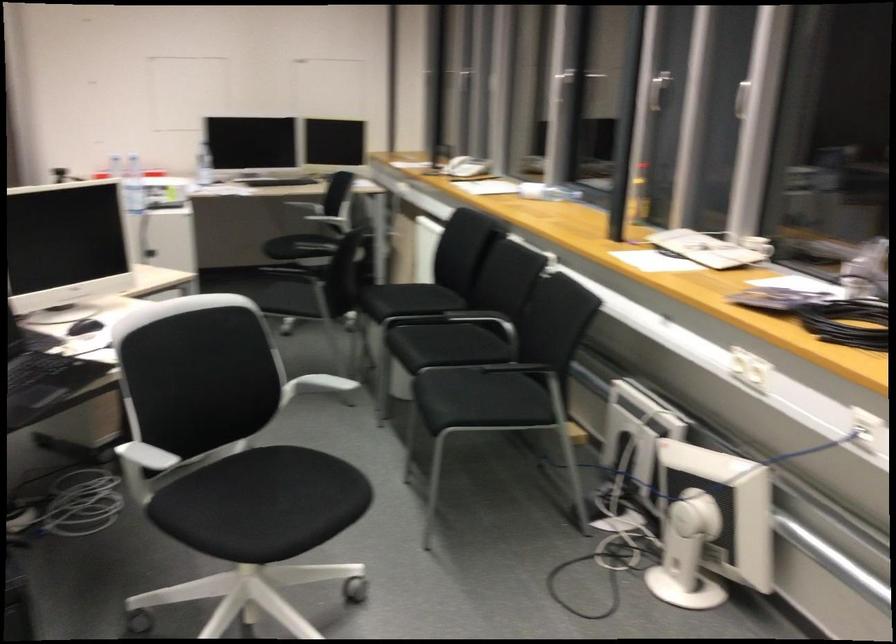
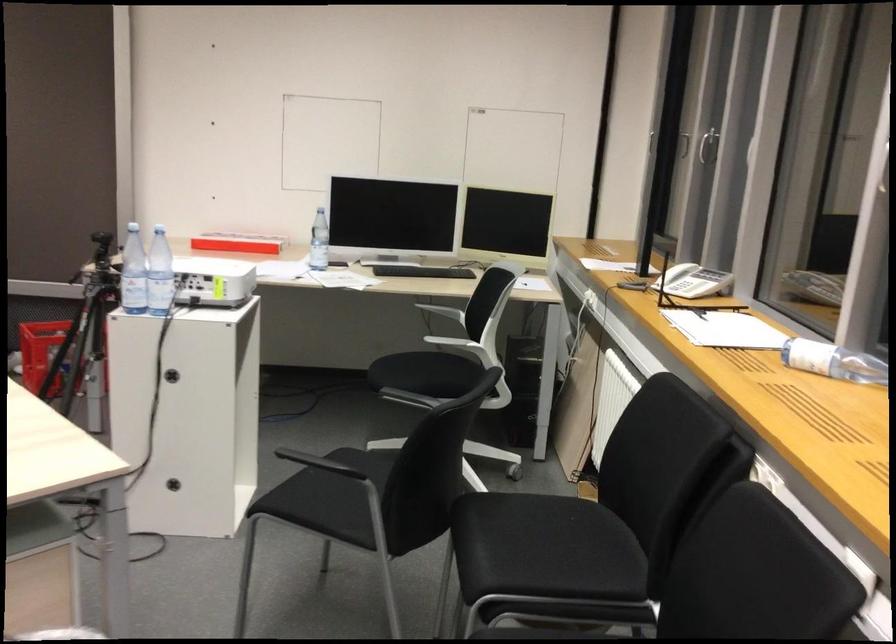
Question: In a continuous first-person perspective shot, in which direction is the camera moving?

Choices:
 (A) Left
 (B) Right
 (C) Forward
 (D) Backward

Answer: (C)